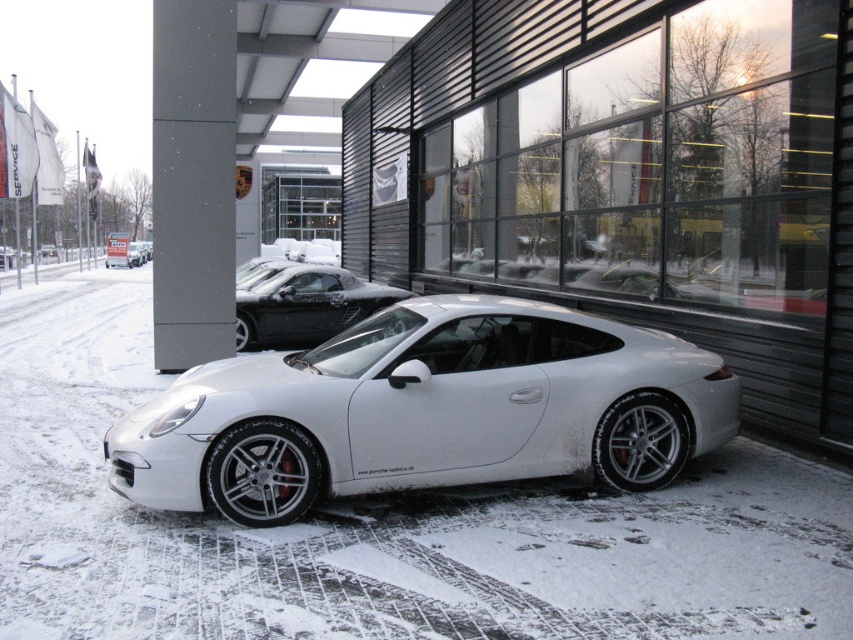
Question: Which of the following is the farthest from the observer?

Choices:
 (A) white matte car at center
 (B) glossy black car at center
 (C) white metallic sports car at center

Answer: (A)

Question: In this image, where is white metallic sports car at center located relative to white matte car at center?

Choices:
 (A) above
 (B) below

Answer: (B)

Question: Which point appears farthest from the camera in this image?

Choices:
 (A) (358, 289)
 (B) (128, 483)
 (C) (44, 252)

Answer: (C)

Question: From the image, what is the correct spatial relationship of glossy black car at center in relation to white matte car at center?

Choices:
 (A) left
 (B) right

Answer: (B)

Question: Which object is the closest to the glossy black car at center?

Choices:
 (A) white metallic sports car at center
 (B) white matte car at center

Answer: (A)

Question: Is the position of white metallic sports car at center more distant than that of glossy black car at center?

Choices:
 (A) yes
 (B) no

Answer: (B)